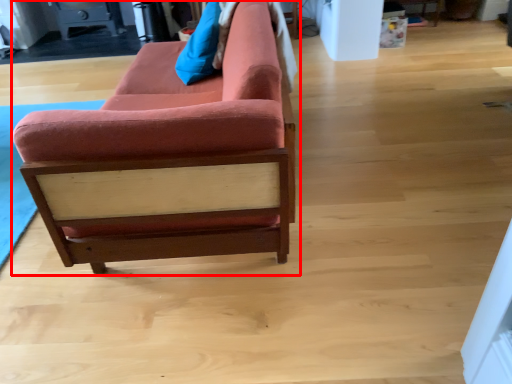
Question: From the image, what is the correct spatial relationship of studio couch (annotated by the red box) in relation to pillow?

Choices:
 (A) right
 (B) left

Answer: (A)